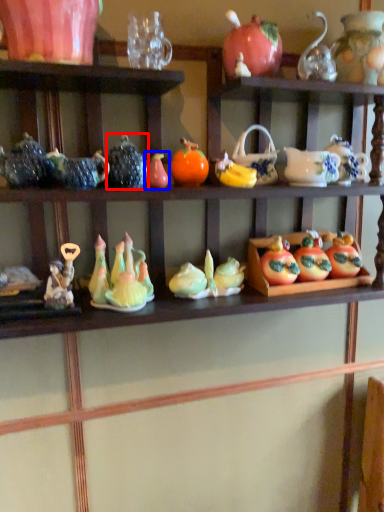
Question: Which object is further to the camera taking this photo, tableware (highlighted by a red box) or toy (highlighted by a blue box)?

Choices:
 (A) tableware
 (B) toy

Answer: (B)